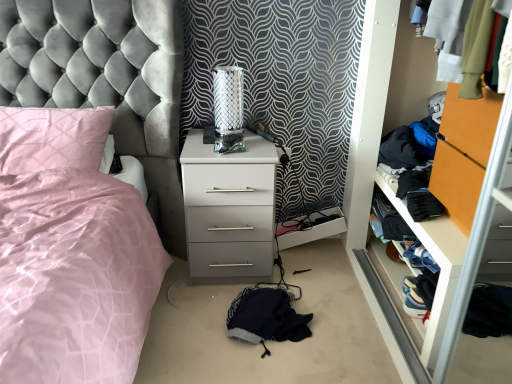
Where is `blank space situated above white glossy chest of drawers at center (from a real-world perspective)`? This screenshot has height=384, width=512. blank space situated above white glossy chest of drawers at center (from a real-world perspective) is located at coordinates (227, 143).